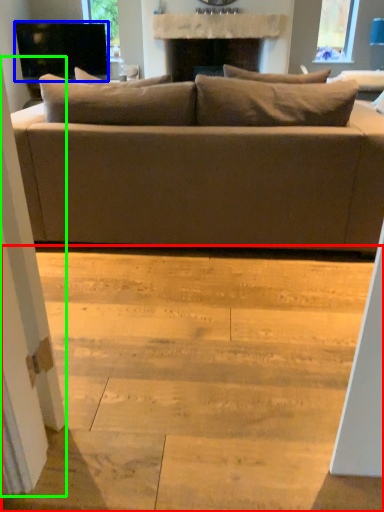
Question: Which is nearer to the stair (highlighted by a red box)? television (highlighted by a blue box) or screen door (highlighted by a green box).

Choices:
 (A) television
 (B) screen door

Answer: (B)